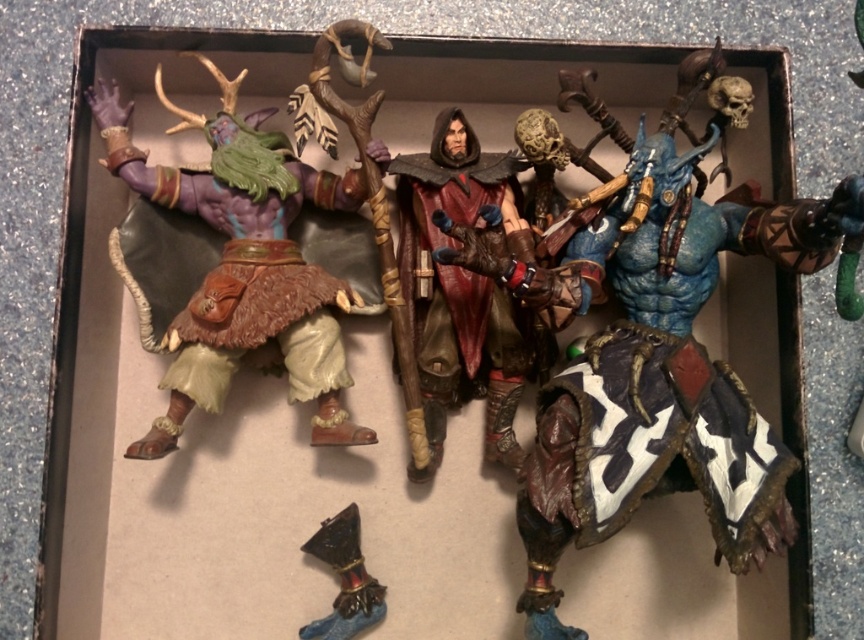
Does point (198, 394) come closer to viewer compared to point (350, 547)?

Yes, point (198, 394) is in front of point (350, 547).

Between matte purple skin at left and metallic blue boot at lower center, which one is positioned lower?

metallic blue boot at lower center is below.

Locate an element on the screen. This screenshot has height=640, width=864. matte purple skin at left is located at coordinates (242, 262).

Where is `matte purple skin at left`? The width and height of the screenshot is (864, 640). matte purple skin at left is located at coordinates (242, 262).

Looking at this image, can you confirm if matte purple skin at left is positioned below smooth brown cape at center?

Incorrect, matte purple skin at left is not positioned below smooth brown cape at center.

The width and height of the screenshot is (864, 640). I want to click on matte purple skin at left, so click(242, 262).

Is smooth brown cape at center below metallic blue boot at lower center?

No, smooth brown cape at center is not below metallic blue boot at lower center.

Who is higher up, smooth brown cape at center or metallic blue boot at lower center?

Positioned higher is smooth brown cape at center.

Which is behind, point (436, 371) or point (328, 636)?

The point (328, 636) is behind.

Find the location of `smooth brown cape at center`. smooth brown cape at center is located at coordinates (458, 289).